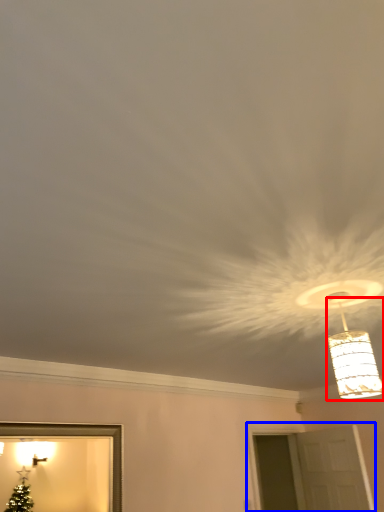
Question: Which object appears farthest to the camera in this image, lamp (highlighted by a red box) or window (highlighted by a blue box)?

Choices:
 (A) lamp
 (B) window

Answer: (B)